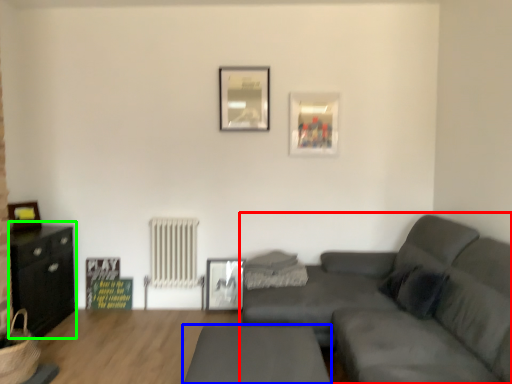
Question: Estimate the real-world distances between objects in this image. Which object is closer to studio couch (highlighted by a red box), table (highlighted by a blue box) or entertainment center (highlighted by a green box)?

Choices:
 (A) table
 (B) entertainment center

Answer: (A)